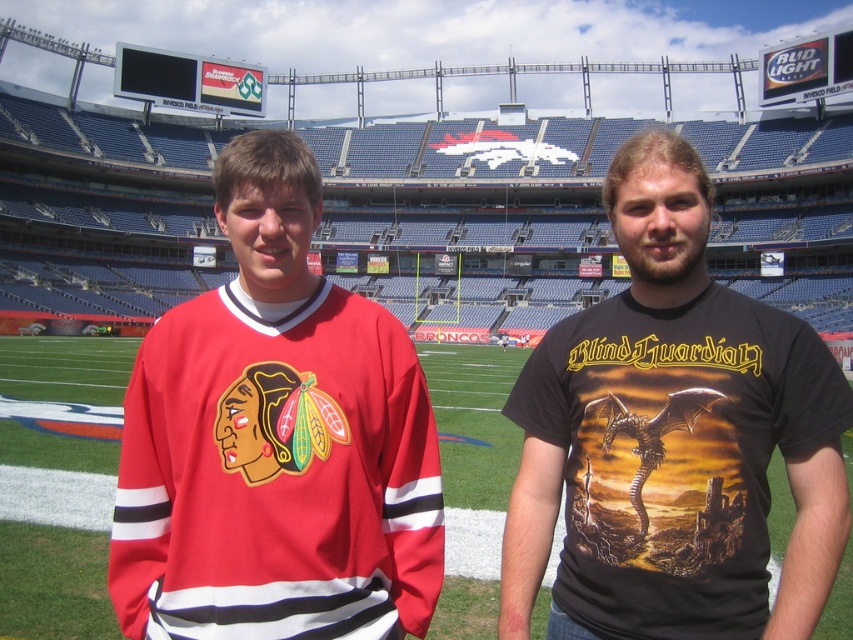
Can you confirm if matte jersey at center is positioned below black matte t-shirt at center?

Correct, matte jersey at center is located below black matte t-shirt at center.

Does matte jersey at center appear on the left side of black matte t-shirt at center?

Yes, matte jersey at center is to the left of black matte t-shirt at center.

Who is more forward, (140,570) or (798,356)?

Point (140,570) is in front.

This screenshot has height=640, width=853. Identify the location of matte jersey at center. (276, 440).

Does black matte t-shirt at center have a smaller size compared to green grass football field at center?

Indeed, black matte t-shirt at center has a smaller size compared to green grass football field at center.

Is black matte t-shirt at center shorter than green grass football field at center?

No, black matte t-shirt at center is not shorter than green grass football field at center.

Find the location of a particular element. black matte t-shirt at center is located at coordinates (672, 438).

Which of these two, matte jersey at center or green grass football field at center, stands taller?

matte jersey at center is taller.

Is point (401, 586) farther from viewer compared to point (27, 568)?

No.

Locate an element on the screen. matte jersey at center is located at coordinates click(276, 440).